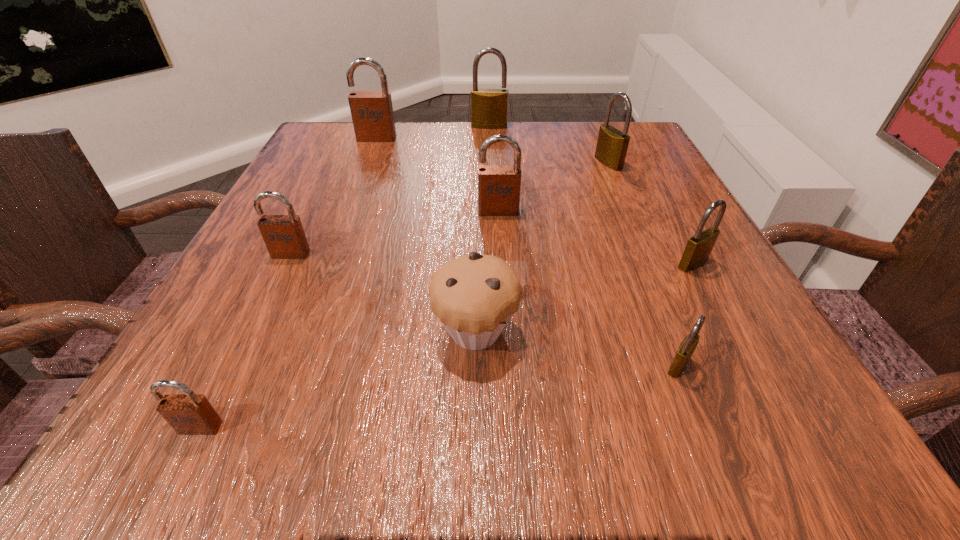
Where is `the farthest brass padlock`? the farthest brass padlock is located at coordinates (489, 107).

The image size is (960, 540). Find the location of `the biggest brass padlock`. the biggest brass padlock is located at coordinates (489, 107).

Where is `the farthest brown padlock`? This screenshot has height=540, width=960. the farthest brown padlock is located at coordinates (372, 114).

Identify the location of the biggest brown padlock. The height and width of the screenshot is (540, 960). (372, 114).

This screenshot has width=960, height=540. Identify the location of the seventh nearest object. (611, 149).

Where is `the third smallest brass padlock`? the third smallest brass padlock is located at coordinates (611, 149).

This screenshot has height=540, width=960. In order to click on the rightmost brown padlock in this screenshot , I will do `click(499, 186)`.

At what (x,y) coordinates should I click in order to perform the action: click on the second farthest brown padlock. Please return your answer as a coordinate pair (x, y). Looking at the image, I should click on (499, 186).

Image resolution: width=960 pixels, height=540 pixels. Identify the location of the third farthest brown padlock. (284, 236).

In order to click on the second smallest brass padlock in this screenshot , I will do click(698, 249).